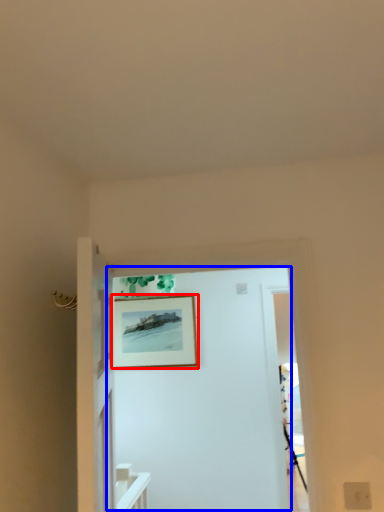
Question: Among these objects, which one is nearest to the camera, picture frame (highlighted by a red box) or door (highlighted by a blue box)?

Choices:
 (A) picture frame
 (B) door

Answer: (B)